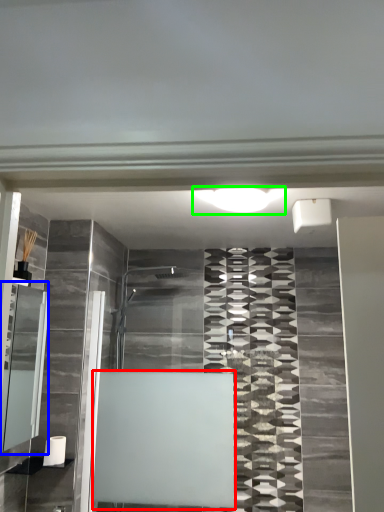
Question: Based on their relative distances, which object is farther from bath (highlighted by a red box)? Choose from cabinet (highlighted by a blue box) and light (highlighted by a green box).

Choices:
 (A) cabinet
 (B) light

Answer: (B)